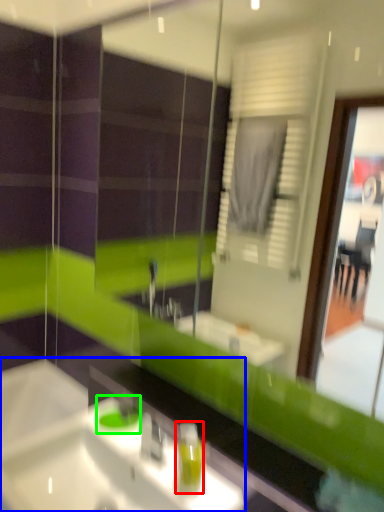
Question: Estimate the real-world distances between objects in this image. Which object is farther from soap dispenser (highlighted by a red box), sink (highlighted by a blue box) or teal (highlighted by a green box)?

Choices:
 (A) sink
 (B) teal

Answer: (B)